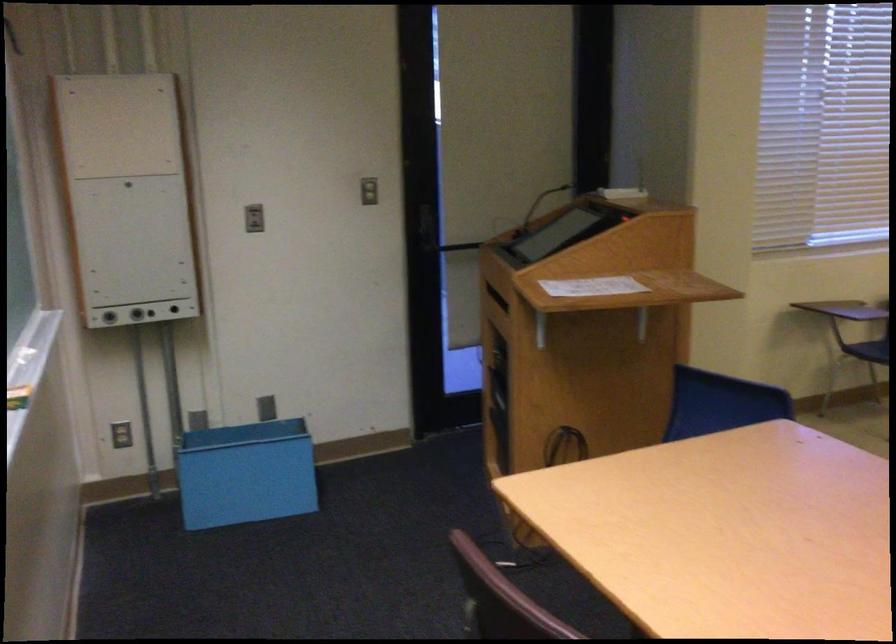
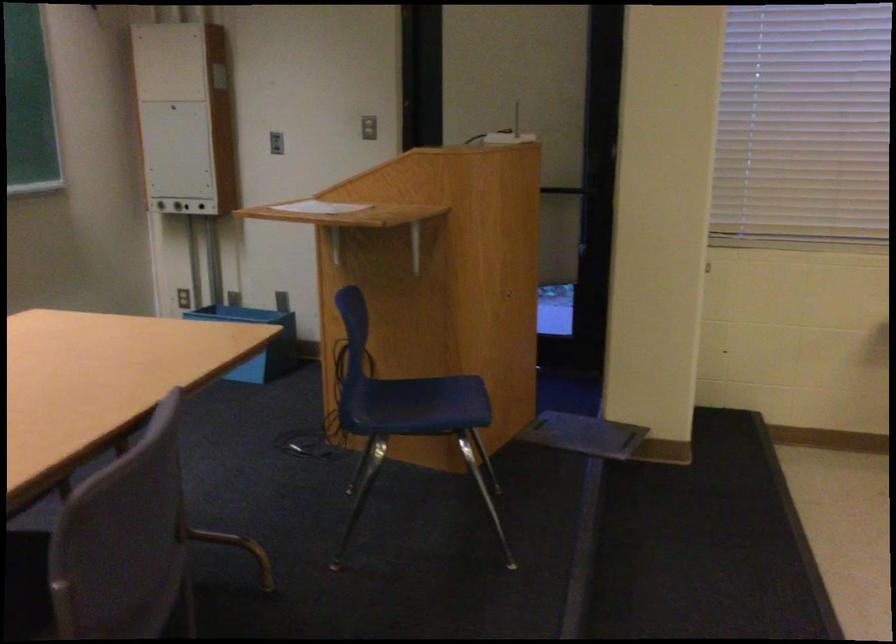
Question: I am providing you with two images of the same scene from different viewpoints. Please identify which objects are invisible in image2.

Choices:
 (A) blue chair sitting surface
 (B) gray chair sitting surface
 (C) door push bar
 (D) none of these

Answer: (D)